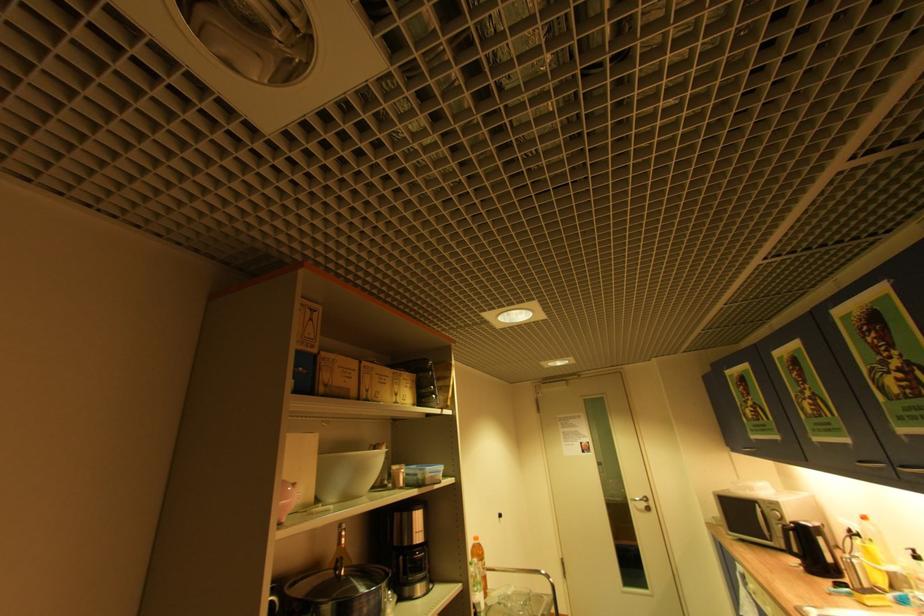
What do you see at coordinates (339, 562) in the screenshot?
I see `the pot lid handle` at bounding box center [339, 562].